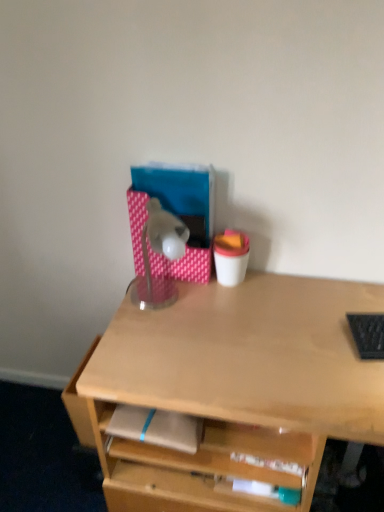
Measure the distance between point (379,336) and camera.

Point (379,336) is 1.09 meters from camera.

Describe the element at coordinates (159, 253) in the screenshot. The width and height of the screenshot is (384, 512). I see `translucent plastic lamp at center` at that location.

Describe the element at coordinates (156, 426) in the screenshot. Image resolution: width=384 pixels, height=512 pixels. I see `light brown matte notepad at center` at that location.

I want to click on black textured laptop keyboard at right, so click(368, 335).

Is black textured laptop keyboard at right in contact with translucent plastic lamp at center?

No, black textured laptop keyboard at right is not making contact with translucent plastic lamp at center.

Who is smaller, black textured laptop keyboard at right or translucent plastic lamp at center?

black textured laptop keyboard at right is smaller.

Is black textured laptop keyboard at right located outside translucent plastic lamp at center?

Yes.

Does black textured laptop keyboard at right have a lesser width compared to translucent plastic lamp at center?

Correct, the width of black textured laptop keyboard at right is less than that of translucent plastic lamp at center.

You are a GUI agent. You are given a task and a screenshot of the screen. Output one action in this format:
    pyautogui.click(x=<x>, y=<y>)
    Task: Click on the lamp on the right of the light brown matte notepad at center
    The width and height of the screenshot is (384, 512).
    Given the screenshot: What is the action you would take?
    pyautogui.click(x=159, y=253)

Which is correct: translucent plastic lamp at center is inside light brown matte notepad at center, or outside of it?

translucent plastic lamp at center exists outside the volume of light brown matte notepad at center.

Is translucent plastic lamp at center positioned far away from light brown matte notepad at center?

translucent plastic lamp at center is actually quite close to light brown matte notepad at center.

Is translucent plastic lamp at center bigger or smaller than light brown matte notepad at center?

In the image, translucent plastic lamp at center appears to be larger than light brown matte notepad at center.

Is light brown matte notepad at center positioned before black textured laptop keyboard at right?

Yes, light brown matte notepad at center is closer to the camera.

From the image's perspective, would you say light brown matte notepad at center is shown under black textured laptop keyboard at right?

Correct, light brown matte notepad at center appears lower than black textured laptop keyboard at right in the image.

Does light brown matte notepad at center appear on the right side of black textured laptop keyboard at right?

No.

From a real-world perspective, is black textured laptop keyboard at right physically located above or below light brown matte notepad at center?

black textured laptop keyboard at right is situated higher than light brown matte notepad at center in the real world.

Find the location of a particular element. notepad in front of the black textured laptop keyboard at right is located at coordinates (156, 426).

Does black textured laptop keyboard at right have a greater width compared to light brown matte notepad at center?

Yes, black textured laptop keyboard at right is wider than light brown matte notepad at center.

Would you consider black textured laptop keyboard at right to be distant from light brown matte notepad at center?

No, black textured laptop keyboard at right is not far away from light brown matte notepad at center.

Is translucent plastic lamp at center positioned far away from black textured laptop keyboard at right?

No, there isn't a large distance between translucent plastic lamp at center and black textured laptop keyboard at right.

Which object is positioned more to the right, translucent plastic lamp at center or black textured laptop keyboard at right?

black textured laptop keyboard at right.

Does point (160, 296) appear closer or farther from the camera than point (371, 336)?

Clearly, point (160, 296) is more distant from the camera than point (371, 336).

Considering the sizes of objects translucent plastic lamp at center and black textured laptop keyboard at right in the image provided, who is shorter, translucent plastic lamp at center or black textured laptop keyboard at right?

Standing shorter between the two is black textured laptop keyboard at right.

Who is smaller, light brown matte notepad at center or translucent plastic lamp at center?

Smaller between the two is light brown matte notepad at center.

From a real-world perspective, is light brown matte notepad at center positioned above or below translucent plastic lamp at center?

light brown matte notepad at center is situated lower than translucent plastic lamp at center in the real world.

Which object is positioned more to the right, light brown matte notepad at center or translucent plastic lamp at center?

Positioned to the right is translucent plastic lamp at center.

Identify the location of lamp located above the black textured laptop keyboard at right (from a real-world perspective). This screenshot has height=512, width=384. (159, 253).

Where is `notepad in front of the translucent plastic lamp at center`? notepad in front of the translucent plastic lamp at center is located at coordinates 156,426.

Based on their spatial positions, is light brown matte notepad at center or translucent plastic lamp at center closer to black textured laptop keyboard at right?

light brown matte notepad at center.

Estimate the real-world distances between objects in this image. Which object is closer to light brown matte notepad at center, translucent plastic lamp at center or black textured laptop keyboard at right?

translucent plastic lamp at center is closer to light brown matte notepad at center.

Looking at the image, which one is located closer to translucent plastic lamp at center, light brown matte notepad at center or black textured laptop keyboard at right?

Based on the image, light brown matte notepad at center appears to be nearer to translucent plastic lamp at center.

Considering their positions, is translucent plastic lamp at center positioned closer to black textured laptop keyboard at right than light brown matte notepad at center?

Based on the image, light brown matte notepad at center appears to be nearer to black textured laptop keyboard at right.

Which object lies further to the anchor point translucent plastic lamp at center, black textured laptop keyboard at right or light brown matte notepad at center?

black textured laptop keyboard at right lies further to translucent plastic lamp at center than the other object.

Which object lies further to the anchor point light brown matte notepad at center, black textured laptop keyboard at right or translucent plastic lamp at center?

Among the two, black textured laptop keyboard at right is located further to light brown matte notepad at center.

In order to click on lamp between light brown matte notepad at center and black textured laptop keyboard at right in this screenshot , I will do `click(159, 253)`.